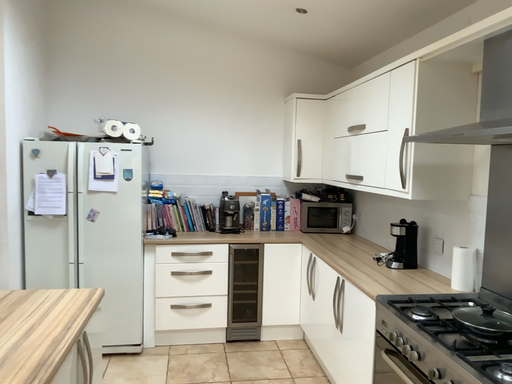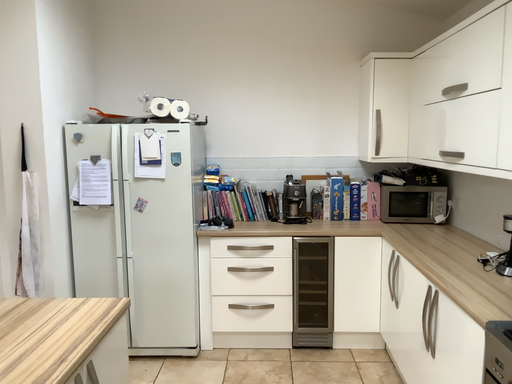
Question: How did the camera likely rotate when shooting the video?

Choices:
 (A) rotated right
 (B) rotated left

Answer: (B)